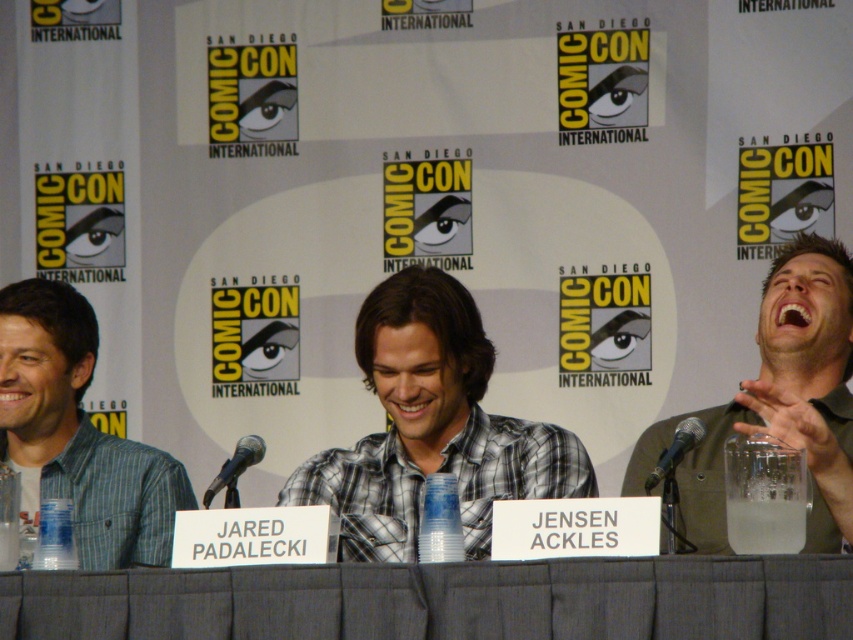
Find the location of a particular element. gray fabric table at center is located at coordinates (444, 600).

Between black metallic microphone at center and black metallic microphone at right, which one is positioned higher?

black metallic microphone at right is higher up.

This screenshot has height=640, width=853. What do you see at coordinates (235, 468) in the screenshot?
I see `black metallic microphone at center` at bounding box center [235, 468].

Find the location of a particular element. Image resolution: width=853 pixels, height=640 pixels. black metallic microphone at center is located at coordinates (235, 468).

Who is more distant from viewer, (160, 493) or (228, 502)?

Positioned behind is point (160, 493).

What do you see at coordinates (79, 433) in the screenshot? The height and width of the screenshot is (640, 853). I see `light blue plaid shirt at center` at bounding box center [79, 433].

Identify the location of light blue plaid shirt at center. This screenshot has height=640, width=853. (79, 433).